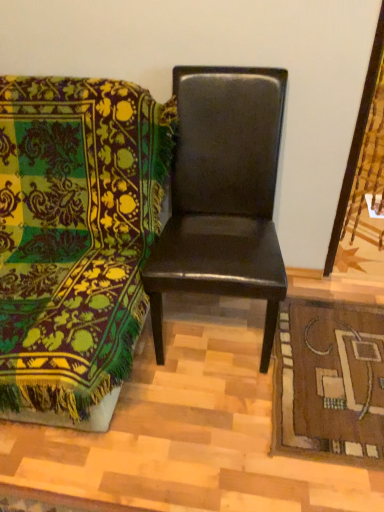
Question: From a real-world perspective, is matte black chair at center, positioned as the 1th chair in left-to-right order, below glossy black chair at center, which is the second chair in left-to-right order?

Choices:
 (A) no
 (B) yes

Answer: (B)

Question: Can you confirm if matte black chair at center, the second chair from the right, is thinner than glossy black chair at center, the first chair positioned from the right?

Choices:
 (A) no
 (B) yes

Answer: (A)

Question: Is matte black chair at center, positioned as the 1th chair in left-to-right order, to the left of glossy black chair at center, the first chair positioned from the right, from the viewer's perspective?

Choices:
 (A) no
 (B) yes

Answer: (B)

Question: From the image's perspective, is matte black chair at center, positioned as the 1th chair in left-to-right order, on glossy black chair at center, which is the second chair in left-to-right order?

Choices:
 (A) no
 (B) yes

Answer: (A)

Question: Is matte black chair at center, the second chair from the right, facing away from glossy black chair at center, which is the second chair in left-to-right order?

Choices:
 (A) no
 (B) yes

Answer: (A)

Question: Considering the relative sizes of matte black chair at center, the second chair from the right, and glossy black chair at center, the first chair positioned from the right, in the image provided, is matte black chair at center, the second chair from the right, bigger than glossy black chair at center, the first chair positioned from the right,?

Choices:
 (A) yes
 (B) no

Answer: (A)

Question: Is glossy black chair at center, which is the second chair in left-to-right order, thinner than matte black chair at center, the second chair from the right?

Choices:
 (A) no
 (B) yes

Answer: (B)

Question: Are glossy black chair at center, the first chair positioned from the right, and matte black chair at center, the second chair from the right, beside each other?

Choices:
 (A) yes
 (B) no

Answer: (B)

Question: Is glossy black chair at center, which is the second chair in left-to-right order, taller than matte black chair at center, positioned as the 1th chair in left-to-right order?

Choices:
 (A) yes
 (B) no

Answer: (A)

Question: From the image's perspective, is glossy black chair at center, which is the second chair in left-to-right order, over matte black chair at center, positioned as the 1th chair in left-to-right order?

Choices:
 (A) yes
 (B) no

Answer: (A)

Question: Is glossy black chair at center, which is the second chair in left-to-right order, not within matte black chair at center, positioned as the 1th chair in left-to-right order?

Choices:
 (A) no
 (B) yes

Answer: (B)

Question: Is glossy black chair at center, the first chair positioned from the right, bigger than matte black chair at center, positioned as the 1th chair in left-to-right order?

Choices:
 (A) yes
 (B) no

Answer: (B)

Question: Considering the relative sizes of brown woven mat at lower right and matte black chair at center, the second chair from the right, in the image provided, is brown woven mat at lower right bigger than matte black chair at center, the second chair from the right,?

Choices:
 (A) no
 (B) yes

Answer: (A)